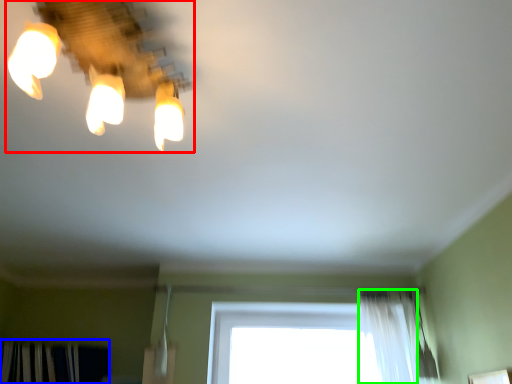
Question: Which object is the farthest from lamp (highlighted by a red box)? Choose among these: curtain (highlighted by a blue box) or shower curtain (highlighted by a green box).

Choices:
 (A) curtain
 (B) shower curtain

Answer: (A)